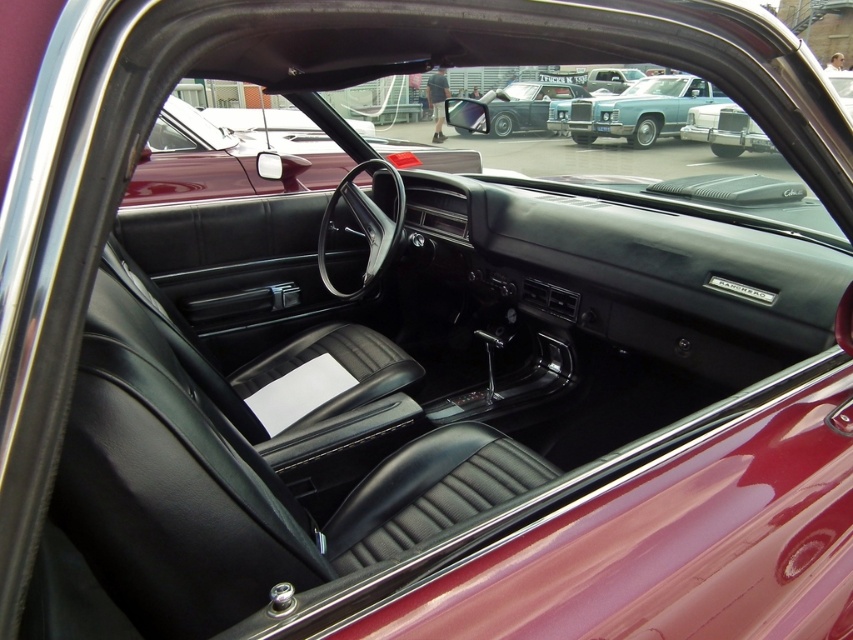
Who is taller, glossy maroon car at center or shiny chrome car at upper center?

Standing taller between the two is shiny chrome car at upper center.

Describe the element at coordinates (231, 154) in the screenshot. I see `glossy maroon car at center` at that location.

Identify the location of glossy maroon car at center. Image resolution: width=853 pixels, height=640 pixels. (231, 154).

Is shiny blue sedan at upper center behind metallic silver car at upper right?

Yes, it is behind metallic silver car at upper right.

Locate an element on the screen. This screenshot has width=853, height=640. shiny blue sedan at upper center is located at coordinates (634, 109).

Identify the location of glossy maroon car at center. The width and height of the screenshot is (853, 640). (231, 154).

Can you confirm if glossy maroon car at center is wider than shiny blue sedan at upper center?

No, glossy maroon car at center is not wider than shiny blue sedan at upper center.

Does point (299, 182) come in front of point (682, 90)?

Yes, it is.

This screenshot has width=853, height=640. Identify the location of glossy maroon car at center. pos(231,154).